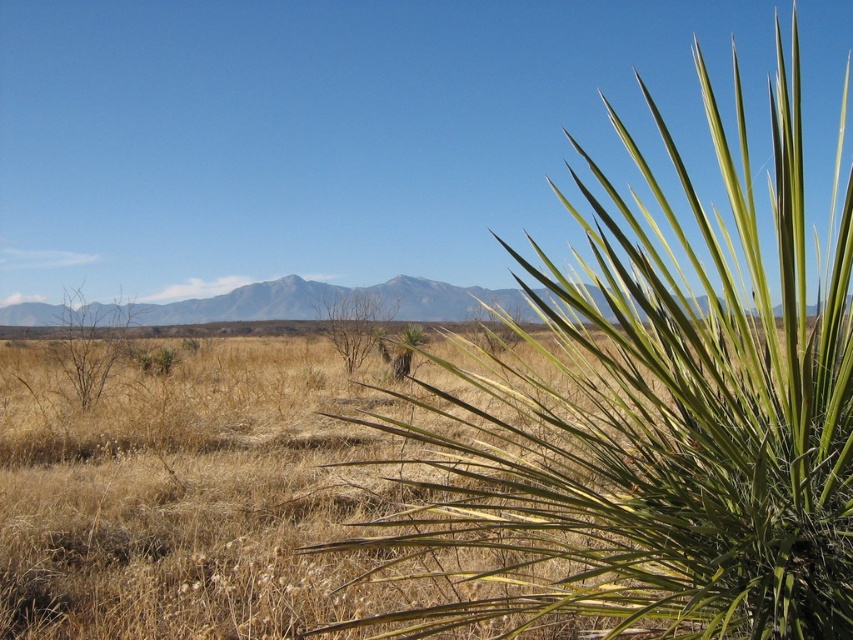
Between point (735, 465) and point (364, 348), which one is positioned in front?

Point (735, 465)

Which is below, green leafy plant at right or brown dry at center?

green leafy plant at right

The image size is (853, 640). In order to click on green leafy plant at right in this screenshot , I will do `click(662, 426)`.

What are the coordinates of `green leafy plant at right` in the screenshot? It's located at (662, 426).

Who is positioned more to the right, green leafy plant at right or brown dry bush at left?

green leafy plant at right is more to the right.

Does point (643, 452) come in front of point (109, 355)?

Yes, it is.

Image resolution: width=853 pixels, height=640 pixels. Identify the location of green leafy plant at right. 662,426.

Between brown dry bush at left and brown dry at center, which one is positioned lower?

Positioned lower is brown dry bush at left.

Which of these two, brown dry bush at left or brown dry at center, stands taller?

Standing taller between the two is brown dry at center.

Who is more forward, (x=51, y=344) or (x=357, y=342)?

Point (x=51, y=344) is in front.

Find the location of a particular element. brown dry bush at left is located at coordinates (90, 342).